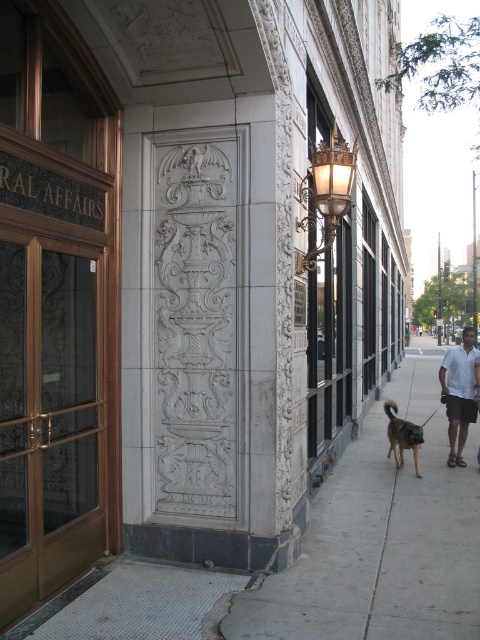
You are an architect analyzing the building facade. You observe two points on the stone panel. Which point is closer to you, point 1 at coordinates (372, 528) or point 2 at coordinates (441, 378)?

Point 1 at coordinates (372, 528) is closer to the viewer than point 2 at coordinates (441, 378).

You are standing in front of the building and notice a white cotton shirt at right. If you want to touch it, should you move to your left or right?

The white cotton shirt at right is located at the right side of the scene, so you should move to your right to reach it.

You are standing at the entrance of the building and want to walk to the gray concrete sidewalk at center. Which direction should you head?

You should head towards the center of the scene, as the gray concrete sidewalk at center is located at point (379, 550).